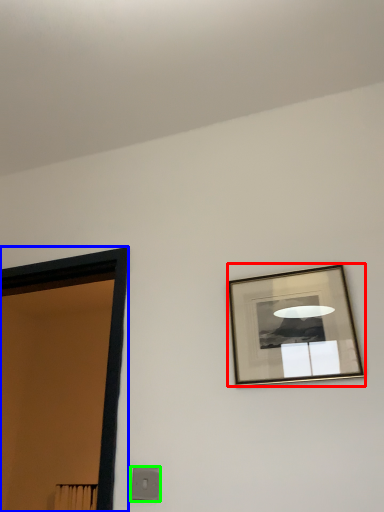
Question: Which is nearer to the picture frame (highlighted by a red box)? door (highlighted by a blue box) or light switch (highlighted by a green box).

Choices:
 (A) door
 (B) light switch

Answer: (B)